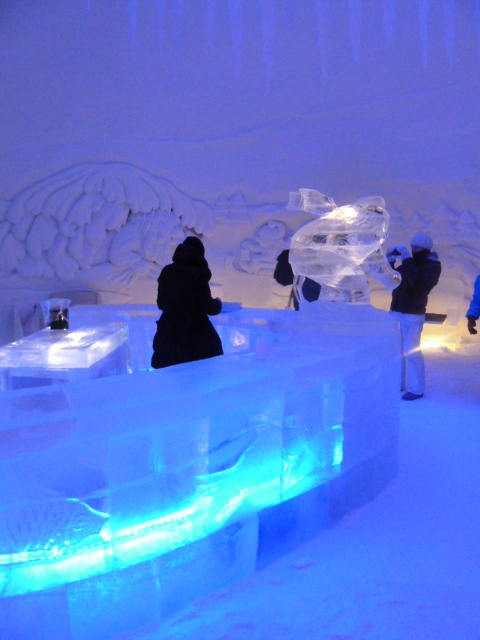
Image resolution: width=480 pixels, height=640 pixels. Find the location of `pitcher`. pitcher is located at coordinates tap(58, 315).